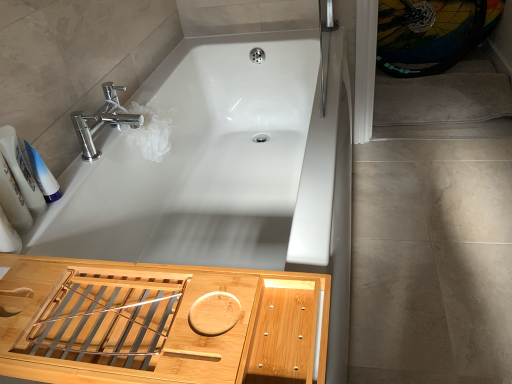
Locate an element on the screen. The height and width of the screenshot is (384, 512). free point behind white plastic tube at left, which is counted as the 1th toiletry, starting from the right is located at coordinates (82, 167).